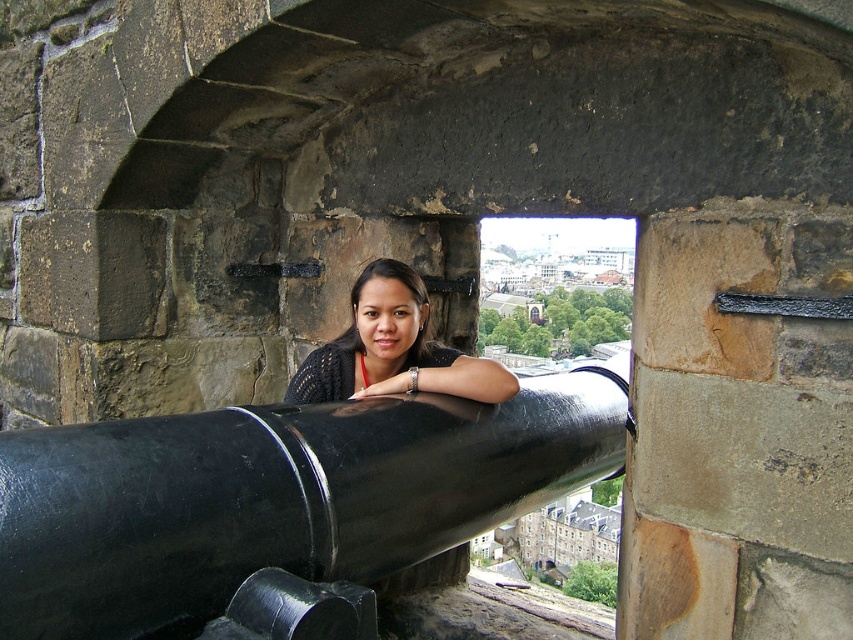
You are standing in front of the stone archway and want to touch both points mentioned. Which point should you reach for first, the point at coordinates (500, 522) or the point at (448, 392)?

You should reach for point (500, 522) first because it is closer to you than point (448, 392), which is further away.

You are standing in front of the stone archway and want to place a small flag exactly at the center of the black polished cannon at center. According to the coordinates provided, what are the coordinates where you should place the flag?

The coordinates for the center of the black polished cannon at center are at point (277, 497), so you should place the flag at those coordinates.

You are a soldier in a historic fortification. You need to determine which object at the center of the archway is wider. Which one is wider between the black polished cannon at center and the matte black sweater at center?

The black polished cannon at center is wider than the matte black sweater at center according to the description.